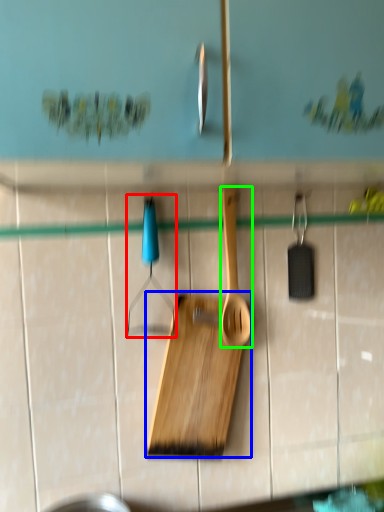
Question: Which object is positioned closest to hanger (highlighted by a red box)? Select from cutting board (highlighted by a blue box) and spatula (highlighted by a green box).

Choices:
 (A) cutting board
 (B) spatula

Answer: (B)